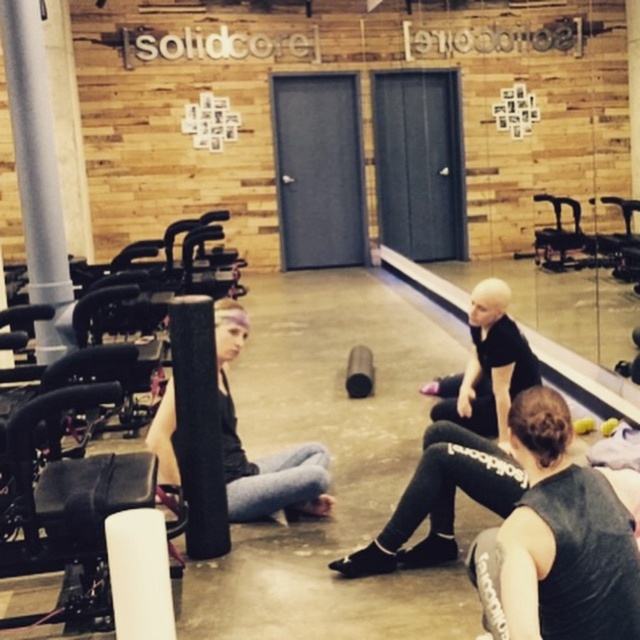
Question: Does black matte leggings at lower right appear over matte black squat at center?

Choices:
 (A) yes
 (B) no

Answer: (B)

Question: Is black matte leggings at lower right above matte black squat at center?

Choices:
 (A) no
 (B) yes

Answer: (A)

Question: Which point is farther from the camera taking this photo?

Choices:
 (A) (220, 378)
 (B) (516, 516)

Answer: (A)

Question: In this image, where is black matte leggings at lower right located relative to matte black squat at center?

Choices:
 (A) right
 (B) left

Answer: (A)